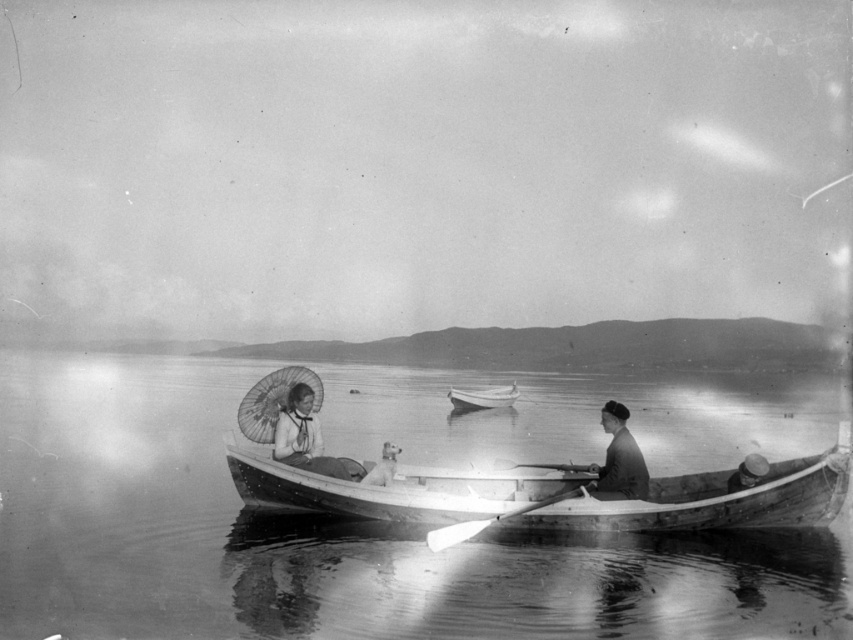
What do you see at coordinates (555, 493) in the screenshot? Image resolution: width=853 pixels, height=640 pixels. I see `wooden canoe at center` at bounding box center [555, 493].

Is point (761, 509) less distant than point (587, 472)?

Yes.

Is point (675, 515) behind point (575, 467)?

That is False.

Where is `wooden canoe at center`? The image size is (853, 640). wooden canoe at center is located at coordinates (555, 493).

Can you confirm if smooth fur dog at center is wider than wooden smooth paddle at center?

In fact, smooth fur dog at center might be narrower than wooden smooth paddle at center.

Is smooth fur dog at center below wooden smooth paddle at center?

Actually, smooth fur dog at center is above wooden smooth paddle at center.

Who is more forward, (378,472) or (523,461)?

Point (378,472)

The width and height of the screenshot is (853, 640). Find the location of `smooth fur dog at center`. smooth fur dog at center is located at coordinates (383, 467).

Is wooden canoe at center positioned at the back of white wood paddle at center?

That is True.

Can you confirm if wooden canoe at center is positioned to the right of white wood paddle at center?

Correct, you'll find wooden canoe at center to the right of white wood paddle at center.

Measure the distance between point (601, 502) and camera.

The distance of point (601, 502) from camera is 14.06 meters.

Locate an element on the screen. This screenshot has height=640, width=853. wooden canoe at center is located at coordinates (555, 493).